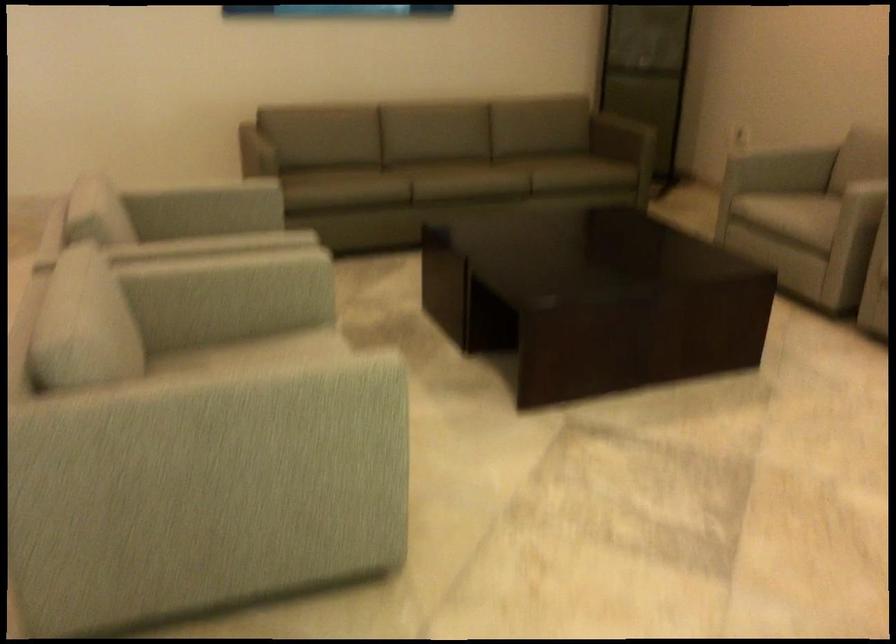
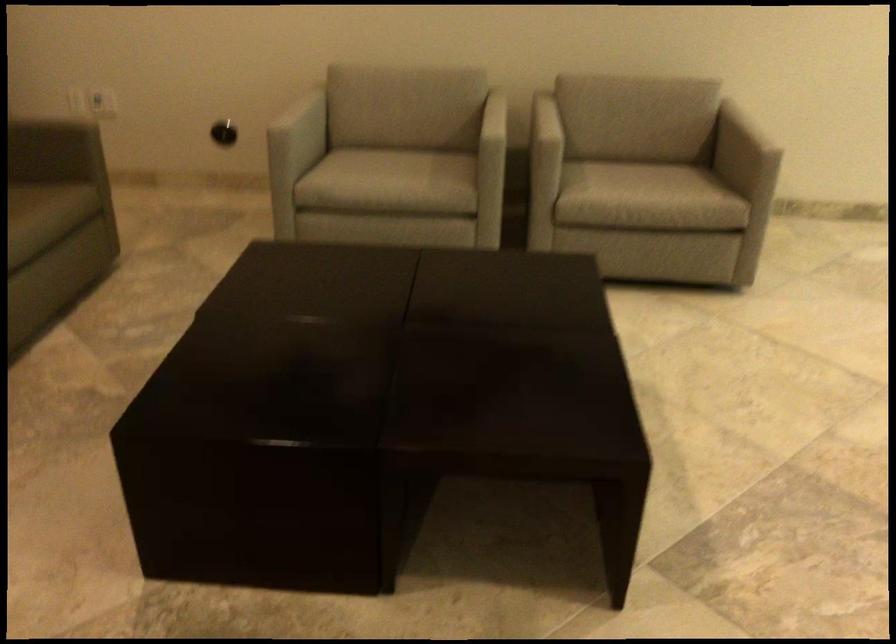
In the second image, find the point that corresponds to (x=787, y=169) in the first image.

(304, 124)